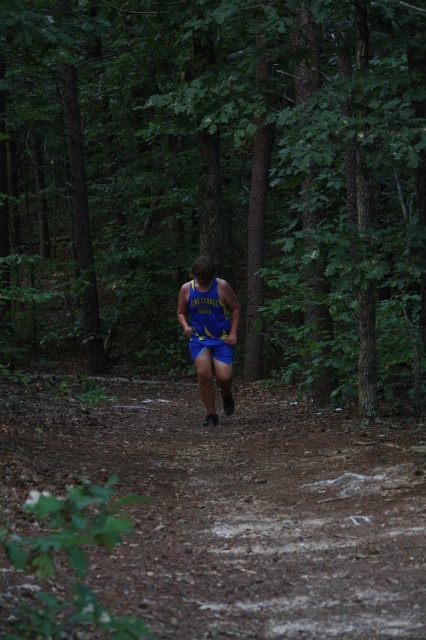
Question: Can you confirm if brown dirt track at center is positioned to the right of yellow jersey at center?

Choices:
 (A) yes
 (B) no

Answer: (B)

Question: Does brown dirt track at center appear on the right side of blue fabric shorts at center?

Choices:
 (A) yes
 (B) no

Answer: (B)

Question: Which point appears farthest from the camera in this image?

Choices:
 (A) (215, 291)
 (B) (215, 316)

Answer: (B)

Question: Which point is farther to the camera?

Choices:
 (A) green matte forest at center
 (B) brown dirt track at center
 (C) yellow jersey at center

Answer: (C)

Question: Which of these objects is positioned farthest from the brown dirt track at center?

Choices:
 (A) blue fabric shorts at center
 (B) yellow jersey at center
 (C) green matte forest at center

Answer: (C)

Question: Can you confirm if brown dirt track at center is smaller than yellow jersey at center?

Choices:
 (A) yes
 (B) no

Answer: (A)